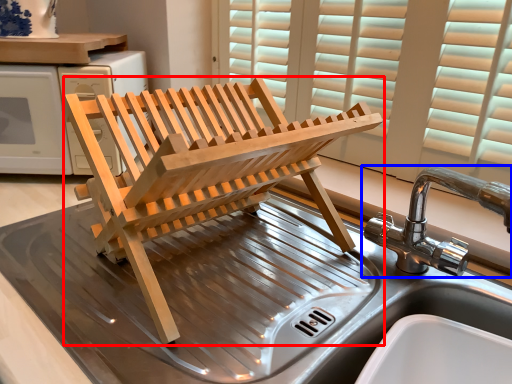
Question: Which of the following is the closest to the observer, furniture (highlighted by a red box) or tap (highlighted by a blue box)?

Choices:
 (A) furniture
 (B) tap

Answer: (A)